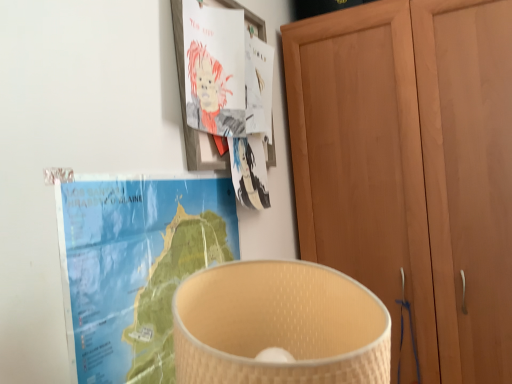
Question: From the image's perspective, does blue paper map at upper left appear lower than wooden cupboard at right?

Choices:
 (A) yes
 (B) no

Answer: (A)

Question: Is blue paper map at upper left taller than wooden cupboard at right?

Choices:
 (A) yes
 (B) no

Answer: (B)

Question: Is blue paper map at upper left further to the viewer compared to wooden cupboard at right?

Choices:
 (A) yes
 (B) no

Answer: (B)

Question: Is blue paper map at upper left facing away from wooden cupboard at right?

Choices:
 (A) no
 (B) yes

Answer: (A)

Question: Does blue paper map at upper left have a greater width compared to wooden cupboard at right?

Choices:
 (A) yes
 (B) no

Answer: (B)

Question: Would you say blue paper map at upper left is outside wooden cupboard at right?

Choices:
 (A) yes
 (B) no

Answer: (A)

Question: From a real-world perspective, is wooden cupboard at right located higher than blue paper map at upper left?

Choices:
 (A) no
 (B) yes

Answer: (A)

Question: Can you confirm if wooden cupboard at right is wider than blue paper map at upper left?

Choices:
 (A) yes
 (B) no

Answer: (A)

Question: Is wooden cupboard at right shorter than blue paper map at upper left?

Choices:
 (A) no
 (B) yes

Answer: (A)

Question: Is there a large distance between wooden cupboard at right and blue paper map at upper left?

Choices:
 (A) no
 (B) yes

Answer: (A)

Question: Can you confirm if wooden cupboard at right is bigger than blue paper map at upper left?

Choices:
 (A) yes
 (B) no

Answer: (A)

Question: Does wooden cupboard at right have a smaller size compared to blue paper map at upper left?

Choices:
 (A) yes
 (B) no

Answer: (B)

Question: Relative to wooden cupboard at right, is blue paper map at upper left in front or behind?

Choices:
 (A) front
 (B) behind

Answer: (A)